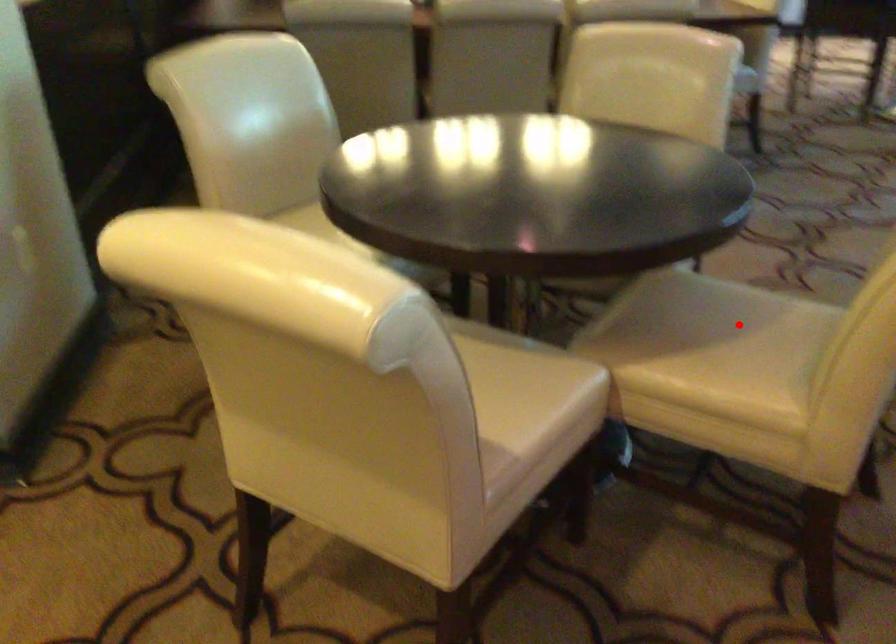
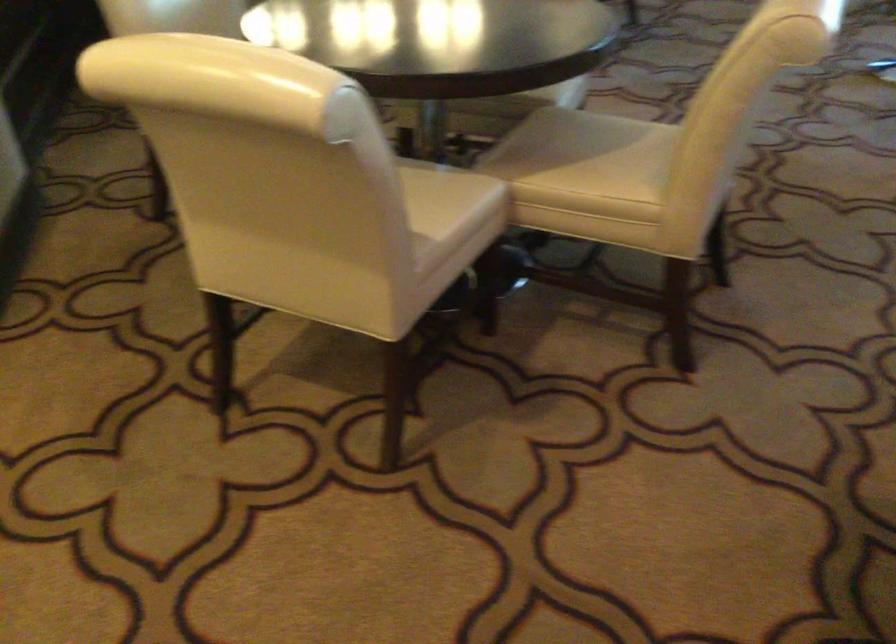
Where in the second image is the point corresponding to the highlighted location from the first image?

(613, 144)